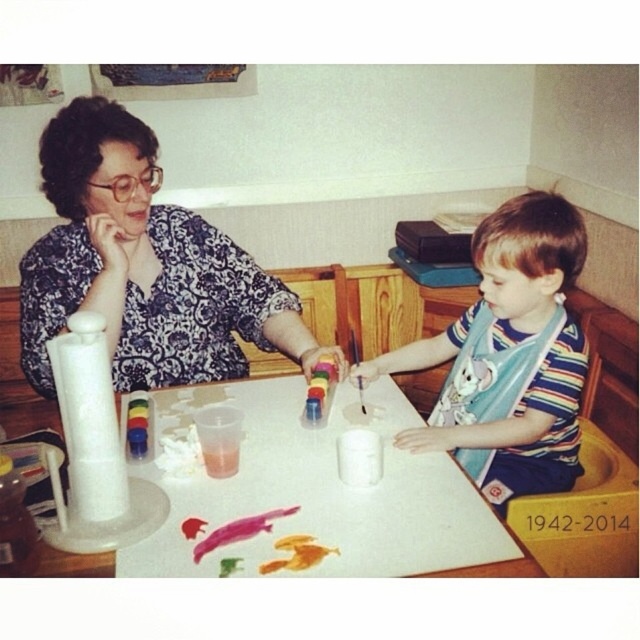
Is floral-patterned blouse at upper left positioned before striped cotton shirt at center?

No, it is not.

Can you confirm if floral-patterned blouse at upper left is positioned above striped cotton shirt at center?

Correct, floral-patterned blouse at upper left is located above striped cotton shirt at center.

Is point (80, 132) positioned after point (502, 456)?

No, it is in front of (502, 456).

What are the coordinates of `floral-patterned blouse at upper left` in the screenshot? It's located at (141, 266).

Who is more distant from viewer, (20, 292) or (312, 394)?

The point (20, 292) is behind.

Does floral-patterned blouse at upper left have a greater height compared to pastel matte crayon at center?

Yes.

Is point (212, 346) less distant than point (314, 376)?

No, it is not.

Where is `floral-patterned blouse at upper left`? The width and height of the screenshot is (640, 640). floral-patterned blouse at upper left is located at coordinates (141, 266).

Looking at this image, who is more forward, (493, 284) or (308, 404)?

Point (308, 404) is more forward.

Is striped cotton shirt at center positioned in front of pastel matte crayon at center?

Yes, it is.

Is point (492, 392) farther from camera compared to point (336, 362)?

Yes.

This screenshot has width=640, height=640. What are the coordinates of `striped cotton shirt at center` in the screenshot? It's located at (506, 282).